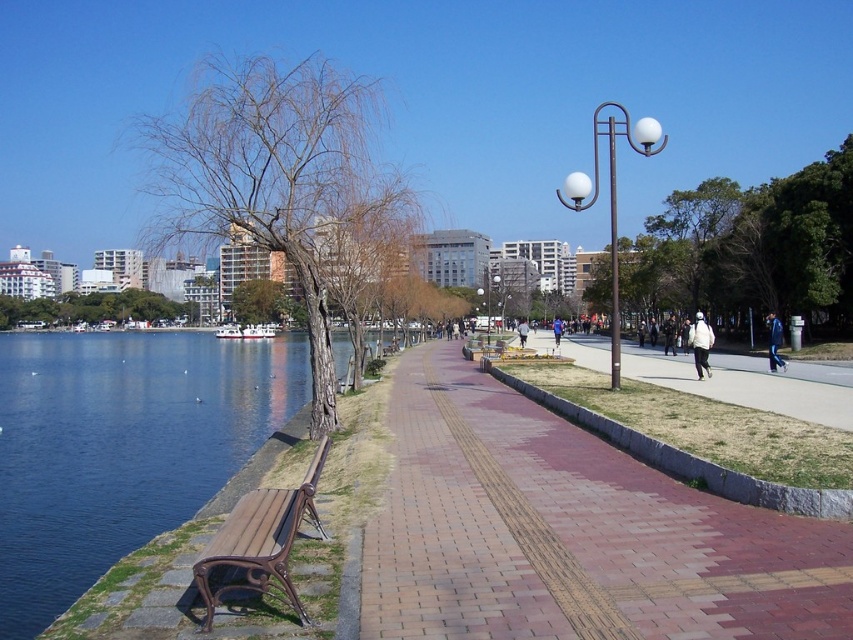
You are a gardener planning to install a new flower bed along the brick paved pathway at center. Considering the clear blue water at bench left is nearby, which area has more space for planting? Please refer to the scene description for context.

The brick paved pathway at center has a lesser width compared to the clear blue water at bench left, so the area near the clear blue water at bench left has more space for planting.